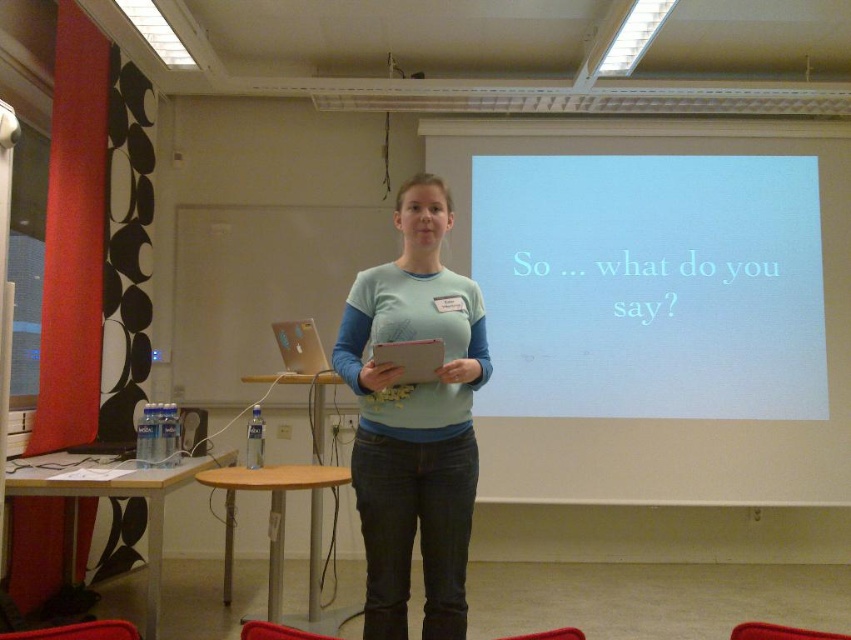
Does white matte projection screen at upper center appear under light blue cotton shirt at center?

Actually, white matte projection screen at upper center is above light blue cotton shirt at center.

Between white matte projection screen at upper center and light blue cotton shirt at center, which one appears on the left side from the viewer's perspective?

From the viewer's perspective, light blue cotton shirt at center appears more on the left side.

Does point (501, 387) come closer to viewer compared to point (450, 344)?

No, it is behind (450, 344).

Identify the location of white matte projection screen at upper center. (650, 285).